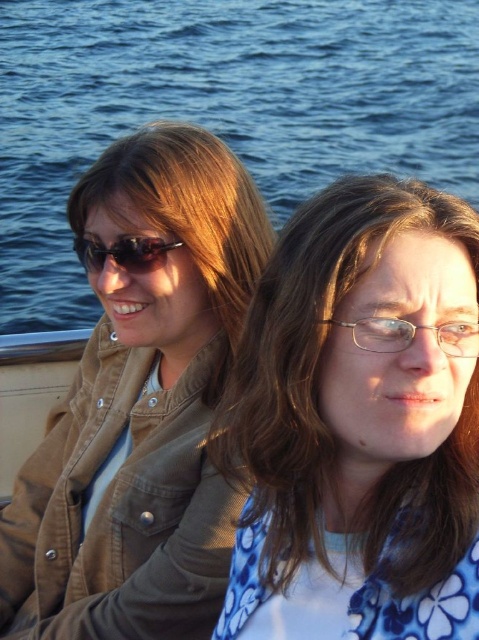
You are a fashion designer observing the scene. You need to determine the relative sizes of the matte brown jacket at left and the blue water at upper center. Which object is larger?

The blue water at upper center is larger than the matte brown jacket at left.

You are a photographer trying to capture a closeup of the matte brown jacket at left and the black plastic sunglasses at upper left. Which object should you focus on first if you want to ensure both are in focus without moving the camera?

The matte brown jacket at left is located below the black plastic sunglasses at upper left. To ensure both are in focus, focus on the matte brown jacket at left first since it is closer to the camera, then adjust the focus to the black plastic sunglasses at upper left if needed.

Based on the coordinates provided, which object corresponds to the point at (140, 406)?

The point at (140, 406) corresponds to the matte brown jacket at left.